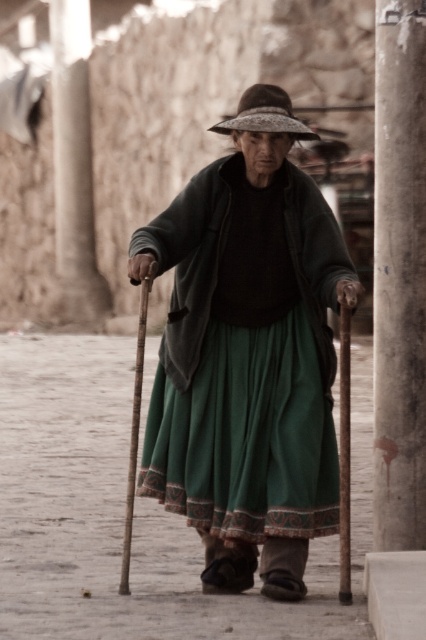
Who is positioned more to the left, smooth concrete pole at right or wooden cane at center?

wooden cane at center

Describe the element at coordinates (345, 454) in the screenshot. The height and width of the screenshot is (640, 426). I see `smooth concrete pole at right` at that location.

You are a GUI agent. You are given a task and a screenshot of the screen. Output one action in this format:
    pyautogui.click(x=<x>, y=<y>)
    Task: Click on the smooth concrete pole at right
    The height and width of the screenshot is (640, 426).
    Given the screenshot: What is the action you would take?
    pyautogui.click(x=345, y=454)

Does dusty concrete pavement at center have a lesser width compared to brown straw hat at center?

No.

Locate an element on the screen. Image resolution: width=426 pixels, height=640 pixels. dusty concrete pavement at center is located at coordinates (135, 513).

Locate an element on the screen. dusty concrete pavement at center is located at coordinates (135, 513).

Is dusty concrete pavement at center positioned at the back of smooth concrete pillar at right?

That is False.

Who is more forward, [172,625] or [391,288]?

Point [172,625]

Image resolution: width=426 pixels, height=640 pixels. Identify the location of dusty concrete pavement at center. (135, 513).